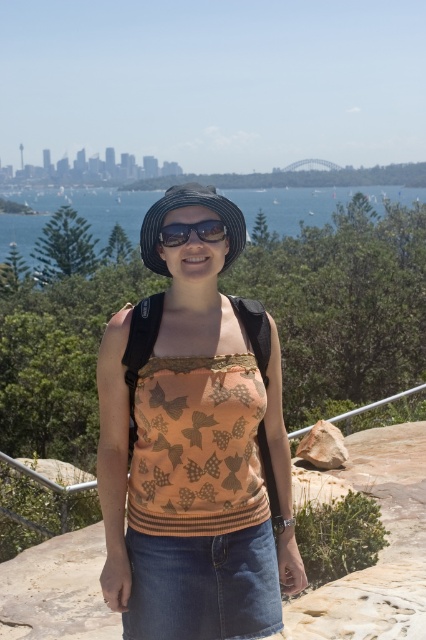
You are a photographer trying to capture a wide shot of the blue water at center and the matte black sunglasses at center. Based on their sizes in the image, which object would appear larger in the photo?

The blue water at center appears larger in the photo because its width surpasses that of the matte black sunglasses at center.

You are a photographer standing at the scenic overlook. You want to capture a clear photo of the matte black hat at center. Considering your camera can focus on objects within 2 meters, will you need to adjust your position to get a sharp image?

The matte black hat at center is 2.17 meters away from the viewer. Since the camera can focus within 2 meters, you need to move closer by approximately 0.17 meters to ensure the matte black hat at center is within the focus range.